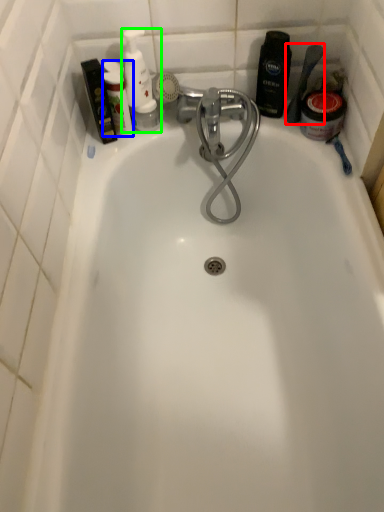
Question: Based on their relative distances, which object is farther from shower (highlighted by a red box)? Choose from toiletry (highlighted by a blue box) and toiletry (highlighted by a green box).

Choices:
 (A) toiletry
 (B) toiletry

Answer: (A)